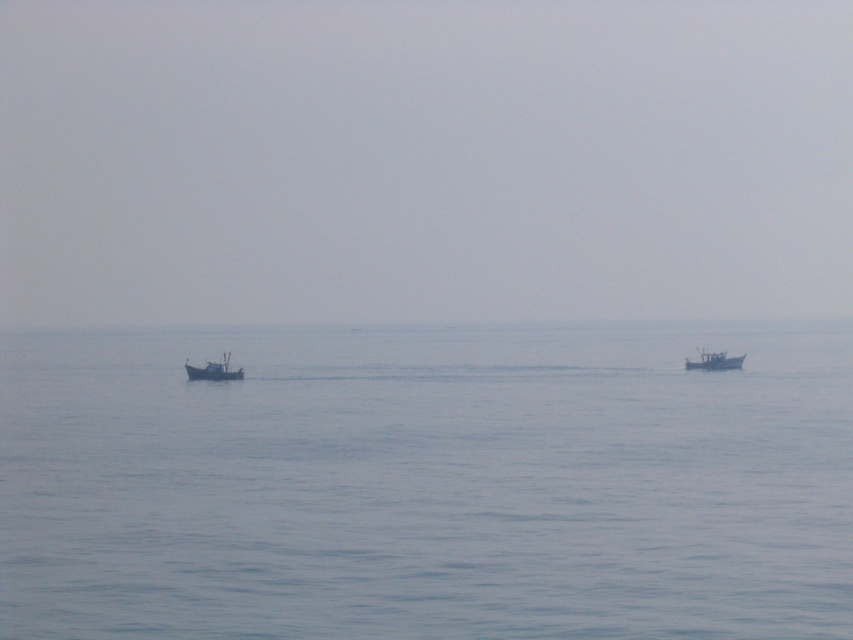
You are standing on a cliff overlooking the seascape and want to take a photo of the point at coordinates point (207, 368). Your camera has a maximum focus range of 70 meters. Will the point be in focus?

Answer: The point point (207, 368) is 74.25 meters from the camera, which exceeds the maximum focus range of 70 meters. Therefore, the point will not be in focus.

You are a sailor navigating a small boat in the image. You notice a specific point marked at coordinates point (422, 161). What is located at this point?

The point (422, 161) marks the gray matte sea at center.